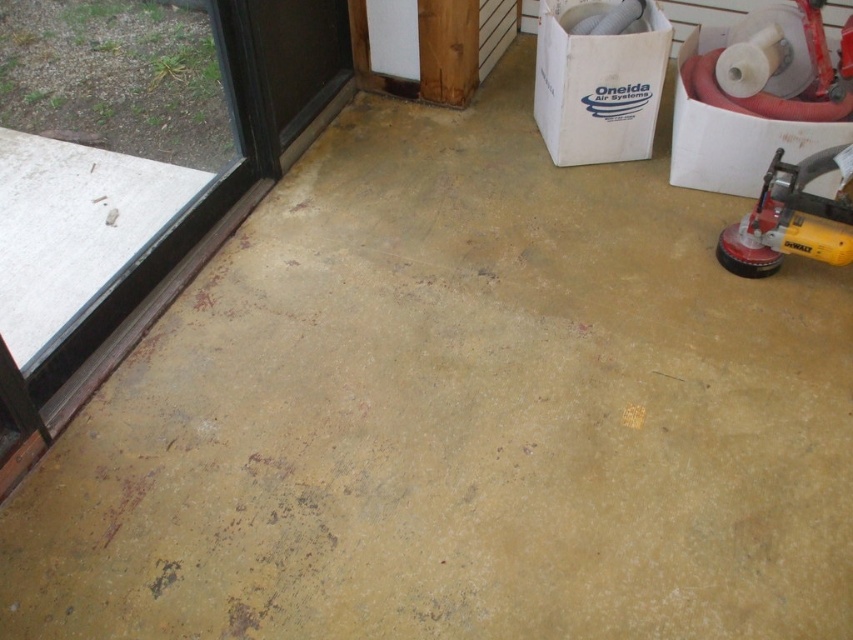
You are standing in the room and want to exit through the glass door at left. Is the point at coordinate (97,262) on the door?

Yes, the point at coordinate (97,262) is on the transparent glass door at left, so you can exit through that door.